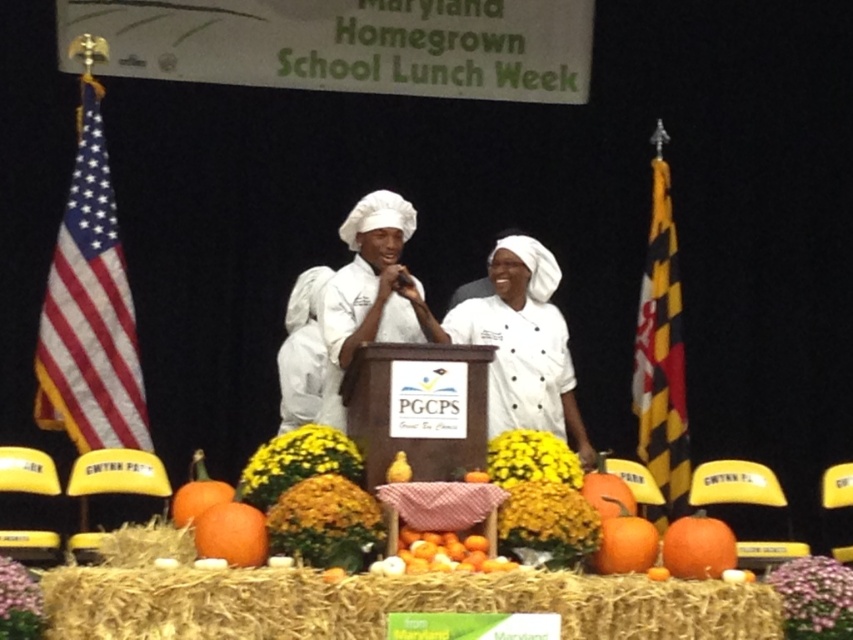
Question: Can you confirm if american flag at left is positioned to the left of orange matte pumpkin at lower right?

Choices:
 (A) no
 (B) yes

Answer: (B)

Question: Estimate the real-world distances between objects in this image. Which object is farther from the orange matte at center?

Choices:
 (A) golden straw hay at center
 (B) yellow striped flag at right
 (C) yellow matte pear at center

Answer: (B)

Question: Which is nearer to the golden straw hay at center?

Choices:
 (A) orange matte pumpkin at lower right
 (B) american flag at left
 (C) yellow striped flag at right

Answer: (A)

Question: Does american flag at left have a larger size compared to orange matte pumpkin at center?

Choices:
 (A) no
 (B) yes

Answer: (B)

Question: Is orange matte pumpkin at center above yellow matte pear at center?

Choices:
 (A) no
 (B) yes

Answer: (A)

Question: Among these points, which one is nearest to the camera?

Choices:
 (A) (668, 547)
 (B) (421, 545)

Answer: (B)